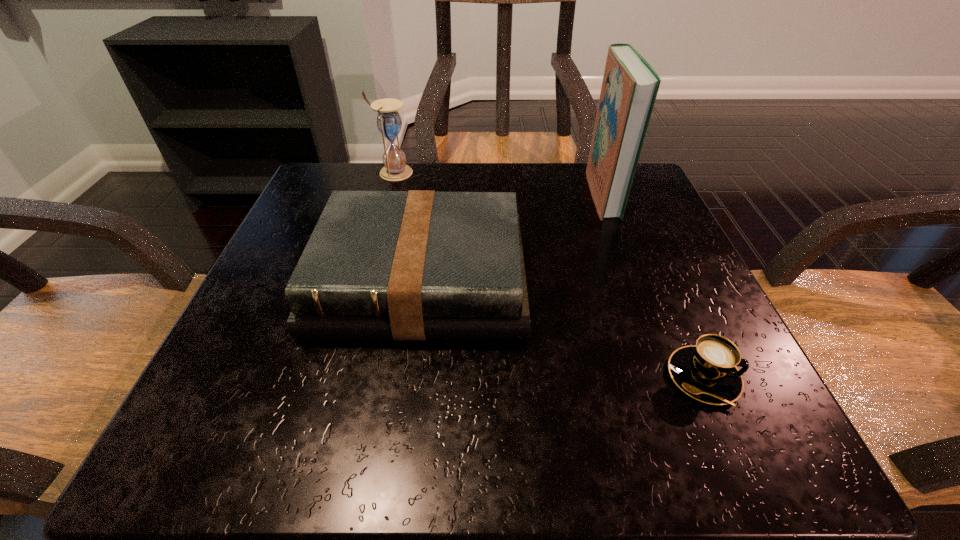
Locate an element on the screen. free space located on the right of the hourglass is located at coordinates (518, 173).

Locate an element on the screen. The width and height of the screenshot is (960, 540). free region located 0.070m on the spine side of the third farthest object is located at coordinates (405, 386).

This screenshot has width=960, height=540. I want to click on blank space located 0.360m on the left of the shortest object, so click(x=404, y=377).

Find the location of a particular element. The height and width of the screenshot is (540, 960). hardback book present at the far edge is located at coordinates (630, 85).

Identify the location of hourglass situated at the far edge. The width and height of the screenshot is (960, 540). pos(389,123).

What are the coordinates of `object that is at the near edge` in the screenshot? It's located at (707, 372).

At what (x,y) coordinates should I click in order to perform the action: click on hourglass that is at the left edge. Please return your answer as a coordinate pair (x, y). The width and height of the screenshot is (960, 540). Looking at the image, I should click on (389, 123).

Find the location of a particular element. This screenshot has height=540, width=960. hardback book situated at the left edge is located at coordinates (413, 265).

The height and width of the screenshot is (540, 960). I want to click on hardback book located in the right edge section of the desktop, so click(630, 85).

I want to click on cappuccino present at the right edge, so click(x=707, y=372).